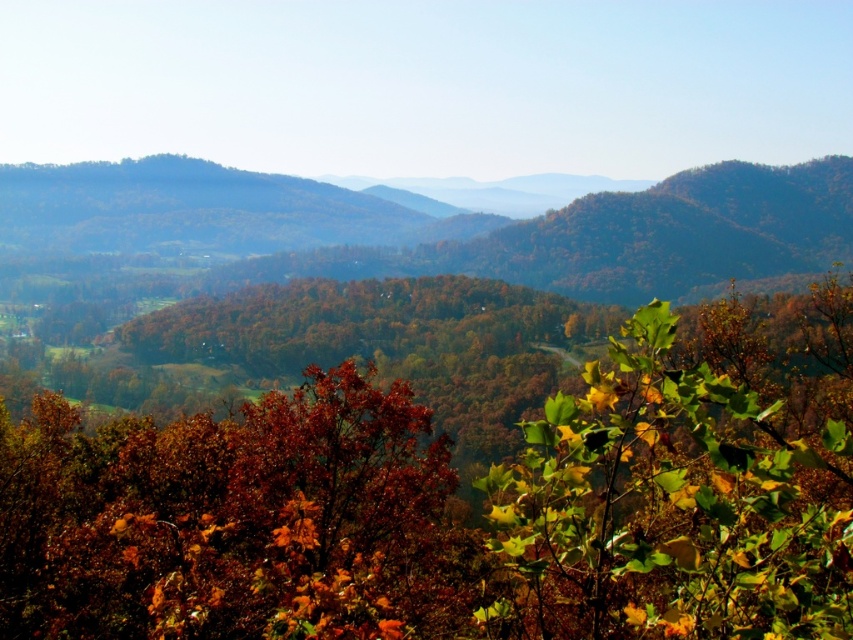
Can you confirm if autumn leaves at center is smaller than green leafy bush at center?

No.

Where is `autumn leaves at center`? Image resolution: width=853 pixels, height=640 pixels. autumn leaves at center is located at coordinates (460, 502).

You are a GUI agent. You are given a task and a screenshot of the screen. Output one action in this format:
    pyautogui.click(x=<x>, y=<y>)
    Task: Click on the autumn leaves at center
    The height and width of the screenshot is (640, 853).
    Given the screenshot: What is the action you would take?
    pyautogui.click(x=460, y=502)